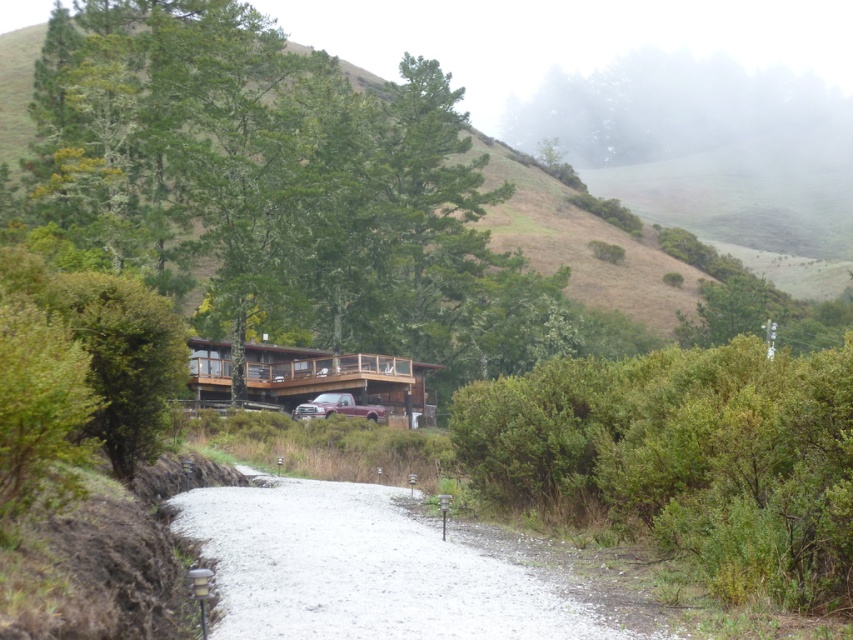
Question: Observing the image, what is the correct spatial positioning of foggy misty hillside at upper center in reference to wooden cabin at center?

Choices:
 (A) above
 (B) below

Answer: (A)

Question: Which of these objects is positioned closest to the metallic maroon truck at center?

Choices:
 (A) white gravel path at center
 (B) wooden cabin at center
 (C) foggy misty hillside at upper center
 (D) green leafy bush at center

Answer: (B)

Question: Which object appears farthest from the camera in this image?

Choices:
 (A) wooden cabin at center
 (B) metallic maroon truck at center
 (C) green leafy bush at center

Answer: (A)

Question: Does green leafy bush at center appear over white gravel path at center?

Choices:
 (A) yes
 (B) no

Answer: (A)

Question: Which of the following is the farthest from the observer?

Choices:
 (A) green leafy bush at center
 (B) metallic maroon truck at center
 (C) foggy misty hillside at upper center
 (D) white gravel path at center

Answer: (C)

Question: Is green leafy bush at center wider than metallic maroon truck at center?

Choices:
 (A) no
 (B) yes

Answer: (B)